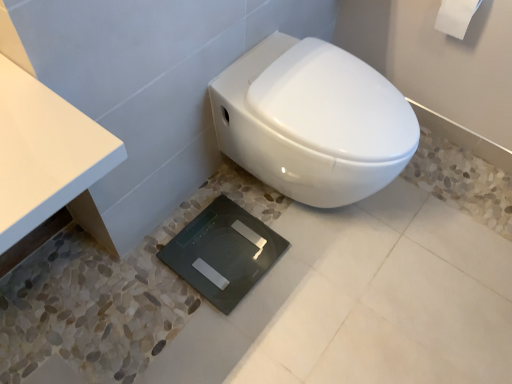
Identify the location of vacant area that lies in front of white glossy toilet at center. The image size is (512, 384). (316, 315).